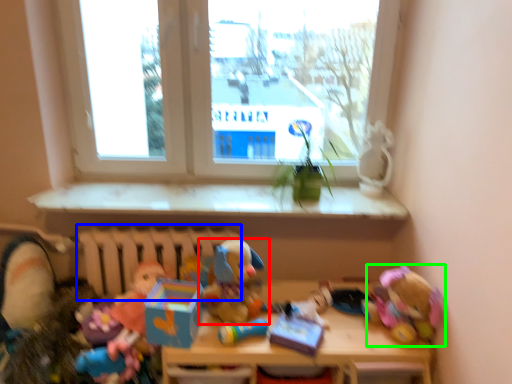
Question: Which is nearer to the toy (highlighted by a red box)? radiator (highlighted by a blue box) or toy (highlighted by a green box).

Choices:
 (A) radiator
 (B) toy

Answer: (A)